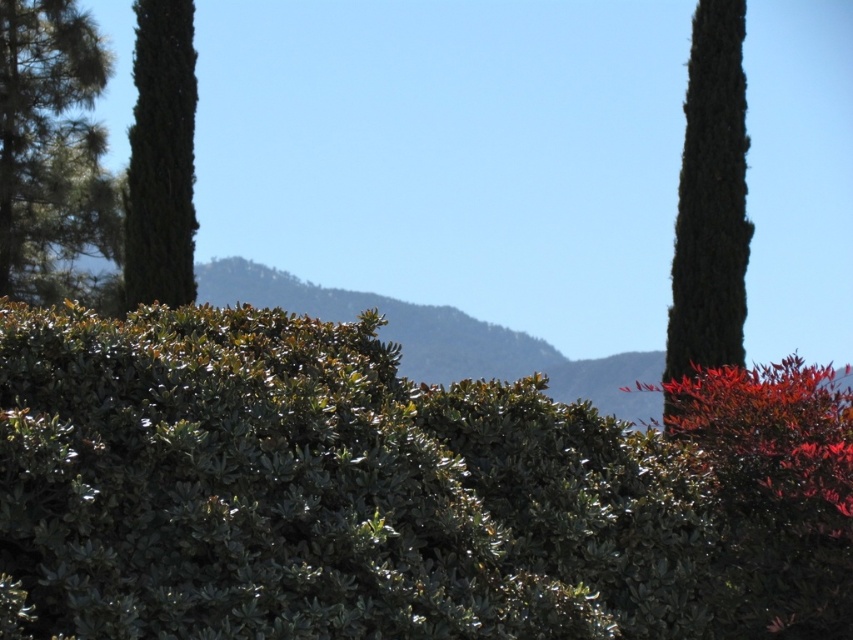
Question: Which point is closer to the camera taking this photo?

Choices:
 (A) (744, 92)
 (B) (142, 116)

Answer: (A)

Question: Among these points, which one is farthest from the camera?

Choices:
 (A) (664, 358)
 (B) (36, 81)

Answer: (B)

Question: Estimate the real-world distances between objects in this image. Which object is closer to the green leafy tree at left?

Choices:
 (A) green rough bark tree at right
 (B) green textured tree at left

Answer: (B)

Question: Is green rough bark tree at right closer to the viewer compared to green textured tree at left?

Choices:
 (A) yes
 (B) no

Answer: (A)

Question: Does green leafy tree at left appear on the left side of green rough bark tree at right?

Choices:
 (A) no
 (B) yes

Answer: (B)

Question: Observing the image, what is the correct spatial positioning of green leafy tree at left in reference to green textured tree at left?

Choices:
 (A) above
 (B) below

Answer: (A)